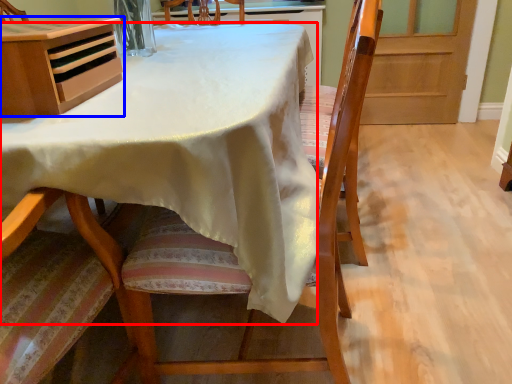
Question: Among these objects, which one is farthest to the camera, table (highlighted by a red box) or cabinetry (highlighted by a blue box)?

Choices:
 (A) table
 (B) cabinetry

Answer: (B)